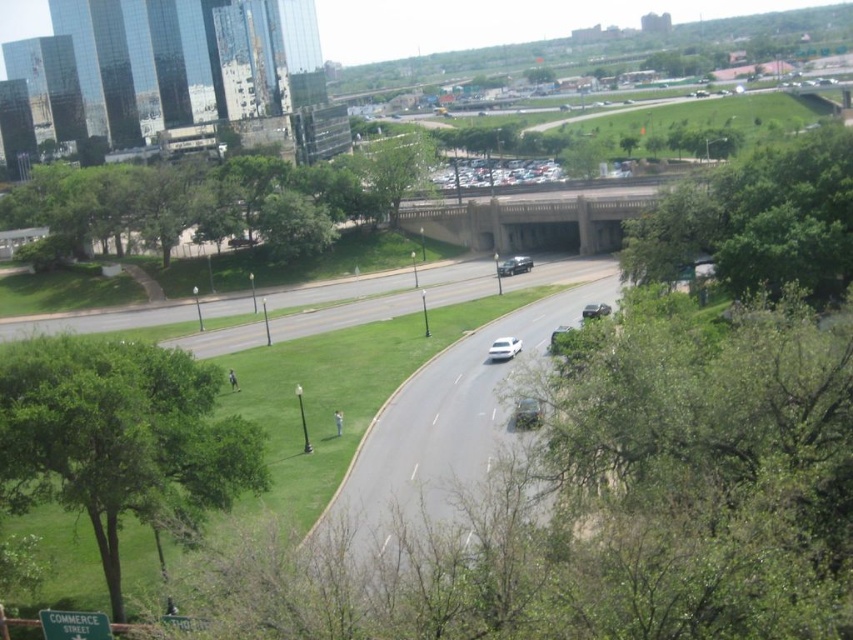
Is gray asphalt highway at center positioned before metallic silver sedan at center?

Yes, it is in front of metallic silver sedan at center.

Is point (531, 342) less distant than point (524, 268)?

Yes, it is.

You are a GUI agent. You are given a task and a screenshot of the screen. Output one action in this format:
    pyautogui.click(x=<x>, y=<y>)
    Task: Click on the gray asphalt highway at center
    The height and width of the screenshot is (640, 853).
    Given the screenshot: What is the action you would take?
    pyautogui.click(x=444, y=424)

Does green leafy tree at lower left have a lesser height compared to green leafy tree at upper left?

Indeed, green leafy tree at lower left has a lesser height compared to green leafy tree at upper left.

Does green leafy tree at lower left appear on the right side of green leafy tree at upper left?

Indeed, green leafy tree at lower left is positioned on the right side of green leafy tree at upper left.

Find the location of `green leafy tree at lower left`. green leafy tree at lower left is located at coordinates 119,436.

The height and width of the screenshot is (640, 853). What do you see at coordinates (756, 220) in the screenshot?
I see `green leafy tree at upper right` at bounding box center [756, 220].

Which is more to the right, green leafy tree at upper right or concrete bridge at center?

From the viewer's perspective, green leafy tree at upper right appears more on the right side.

Is point (724, 273) positioned in front of point (599, 241)?

Yes.

The height and width of the screenshot is (640, 853). I want to click on green leafy tree at upper right, so click(756, 220).